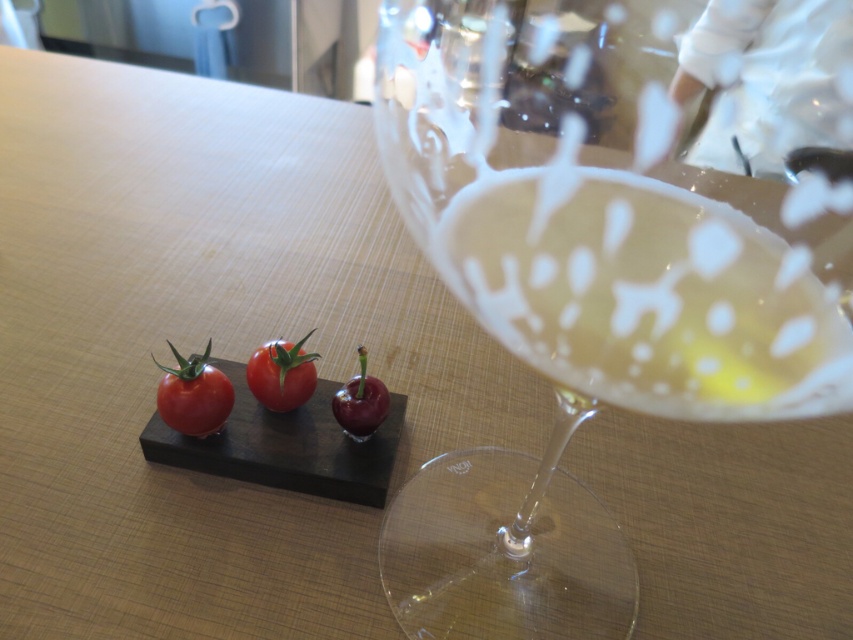
Based on the photo, you are a waiter trying to place a napkin between the glossy red tomato at center and the shiny red cherry at center on the table. Can you fit the napkin between them?

The glossy red tomato at center is closer to you than the shiny red cherry at center, so there is no space between them for the napkin to fit.

You are arranging items on a table and need to place a small black rectangular plate with two cherry tomatoes and one dark red cherry. Where should you place it relative to the clear glass wine glass at center to ensure it is on the left side?

The small black rectangular plate should be placed to the left of the clear glass wine glass at center since the plate is described as being on the left side of the frame in the scene.

You are at a dinner party and see the clear glass wine glass at center and the shiny red cherry at center on the table. Which object is positioned to the right side of the table?

The clear glass wine glass at center is to the right of the shiny red cherry at center, so the clear glass wine glass at center is positioned to the right side of the table.